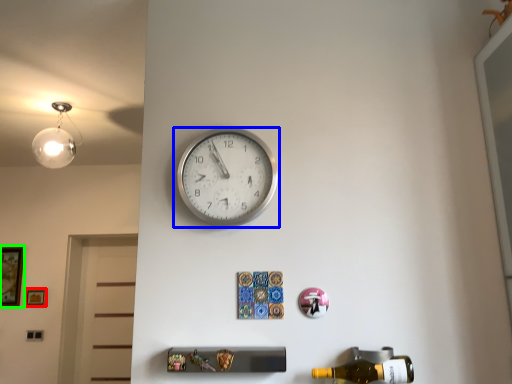
Question: Considering the real-world distances, which object is farthest from picture frame (highlighted by a red box)? wall clock (highlighted by a blue box) or picture frame (highlighted by a green box)?

Choices:
 (A) wall clock
 (B) picture frame

Answer: (A)